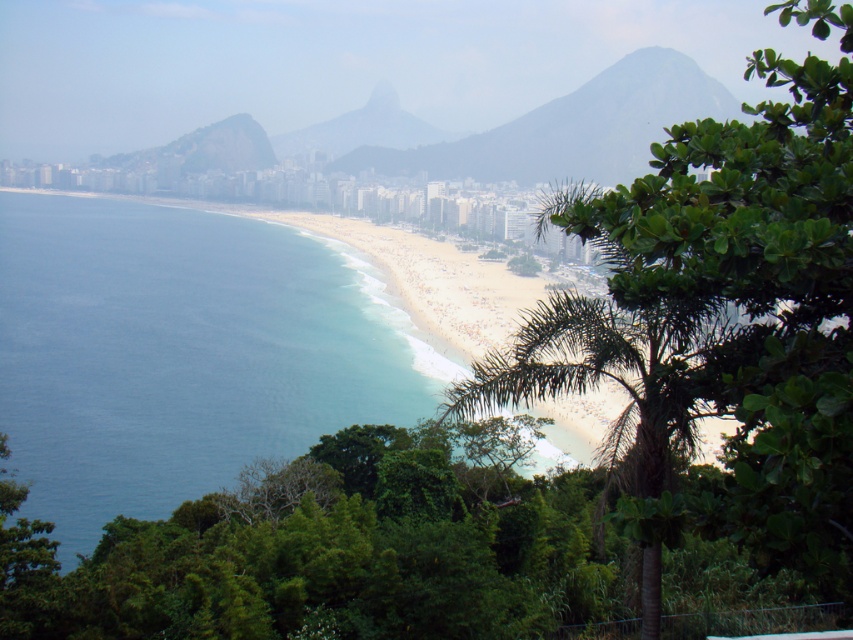
Question: Which of the following is the farthest from the observer?

Choices:
 (A) (473, 150)
 (B) (648, 372)
 (C) (396, 112)

Answer: (C)

Question: Which object is the farthest from the gray rocky mountain at center?

Choices:
 (A) green leafy palm tree at center
 (B) blue water at center
 (C) smooth gray rock at center

Answer: (A)

Question: Does green leafy palm tree at center come in front of gray rocky mountain at center?

Choices:
 (A) yes
 (B) no

Answer: (A)

Question: Can you confirm if green leafy palm tree at center is positioned to the left of gray rocky mountain at center?

Choices:
 (A) yes
 (B) no

Answer: (A)

Question: Which object is closer to the camera taking this photo?

Choices:
 (A) gray rocky mountain at center
 (B) smooth gray rock at center
 (C) green leafy palm tree at center

Answer: (C)

Question: Can you confirm if green leafy palm tree at center is wider than smooth gray rock at center?

Choices:
 (A) yes
 (B) no

Answer: (B)